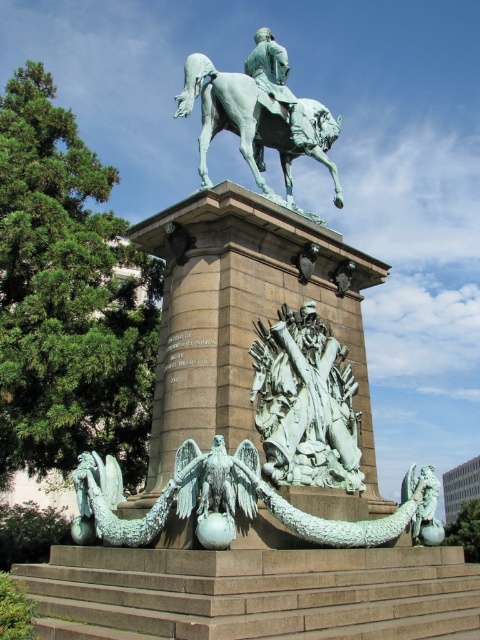
Question: Which point appears closest to the camera in this image?

Choices:
 (A) [x=186, y=90]
 (B) [x=253, y=35]

Answer: (A)

Question: Does bronze textured sculpture at center appear over green patina horse at upper center?

Choices:
 (A) no
 (B) yes

Answer: (A)

Question: Considering the relative positions of green patina statue at center and green patina statue at upper center in the image provided, where is green patina statue at center located with respect to green patina statue at upper center?

Choices:
 (A) above
 (B) below

Answer: (B)

Question: Which of the following is the farthest from the observer?

Choices:
 (A) green patina statue at upper center
 (B) bronze textured sculpture at center

Answer: (A)

Question: Which point appears farthest from the camera in this image?

Choices:
 (A) (307, 458)
 (B) (227, 104)

Answer: (B)

Question: Is green patina statue at center smaller than bronze textured sculpture at center?

Choices:
 (A) yes
 (B) no

Answer: (B)